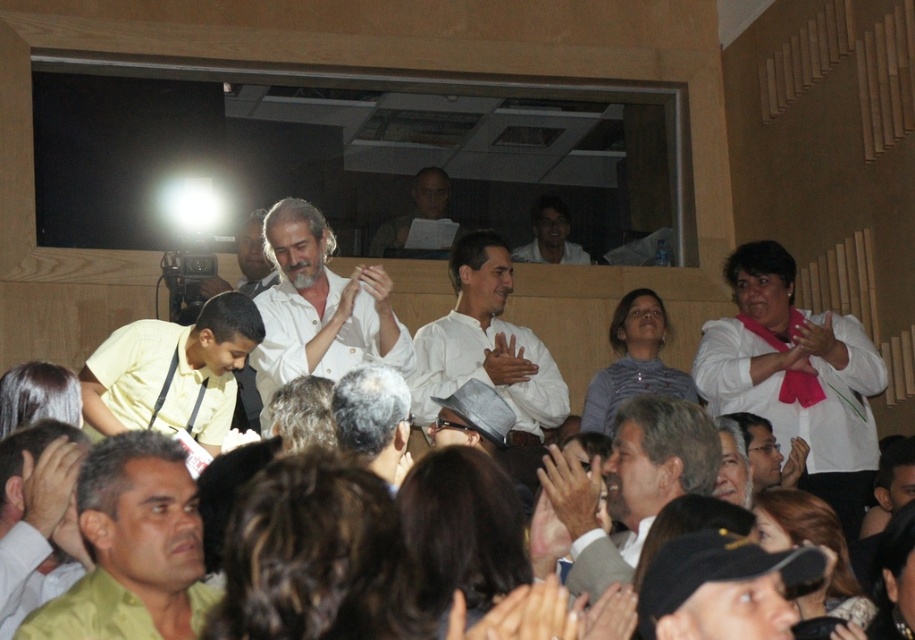
Is point (287, 230) in front of point (665, 332)?

Yes, point (287, 230) is closer to viewer.

Does white matte shirt at center appear on the right side of striped shirt at center?

Incorrect, white matte shirt at center is not on the right side of striped shirt at center.

The image size is (915, 640). Identify the location of white matte shirt at center. (319, 307).

Measure the distance from light green shirt at lower left to striped shirt at center.

39.98 feet

Is point (70, 444) farther from camera compared to point (642, 368)?

No.

What do you see at coordinates (38, 518) in the screenshot? I see `light green shirt at lower left` at bounding box center [38, 518].

Find the location of a particular element. The image size is (915, 640). light green shirt at lower left is located at coordinates (38, 518).

Can you confirm if matte yellow shirt at lower left is positioned above yellow matte shirt at left?

No, matte yellow shirt at lower left is not above yellow matte shirt at left.

Which is more to the right, matte yellow shirt at lower left or yellow matte shirt at left?

From the viewer's perspective, matte yellow shirt at lower left appears more on the right side.

What do you see at coordinates (133, 547) in the screenshot?
I see `matte yellow shirt at lower left` at bounding box center [133, 547].

Find the location of a particular element. The width and height of the screenshot is (915, 640). matte yellow shirt at lower left is located at coordinates (133, 547).